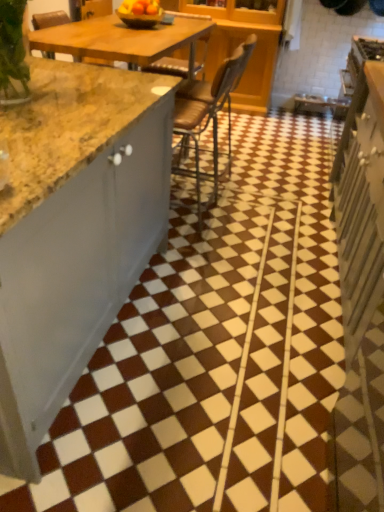
Question: Can brown glossy tile at center be found inside white glossy cabinet at right?

Choices:
 (A) yes
 (B) no

Answer: (B)

Question: From a real-world perspective, is white glossy cabinet at right physically above brown glossy tile at center?

Choices:
 (A) yes
 (B) no

Answer: (A)

Question: From the image's perspective, does white glossy cabinet at right appear lower than brown glossy tile at center?

Choices:
 (A) no
 (B) yes

Answer: (B)

Question: Considering the relative positions of white glossy cabinet at right and brown glossy tile at center in the image provided, is white glossy cabinet at right to the right of brown glossy tile at center from the viewer's perspective?

Choices:
 (A) yes
 (B) no

Answer: (A)

Question: Can you confirm if white glossy cabinet at right is bigger than brown glossy tile at center?

Choices:
 (A) yes
 (B) no

Answer: (B)

Question: Considering the relative positions of brown leather chair at center and white glossy cabinet at right in the image provided, is brown leather chair at center to the left or to the right of white glossy cabinet at right?

Choices:
 (A) right
 (B) left

Answer: (B)

Question: Relative to white glossy cabinet at right, is brown leather chair at center in front or behind?

Choices:
 (A) behind
 (B) front

Answer: (A)

Question: Considering the positions of brown leather chair at center and white glossy cabinet at right in the image, is brown leather chair at center wider or thinner than white glossy cabinet at right?

Choices:
 (A) thin
 (B) wide

Answer: (B)

Question: Does point (243, 46) appear closer or farther from the camera than point (344, 180)?

Choices:
 (A) farther
 (B) closer

Answer: (A)

Question: From a real-world perspective, is white glossy cabinet at right above or below brown leather chair at center?

Choices:
 (A) above
 (B) below

Answer: (B)

Question: In the image, is white glossy cabinet at right positioned in front of or behind brown leather chair at center?

Choices:
 (A) behind
 (B) front

Answer: (B)

Question: Based on their sizes in the image, would you say white glossy cabinet at right is bigger or smaller than brown leather chair at center?

Choices:
 (A) big
 (B) small

Answer: (A)

Question: Considering the positions of white glossy cabinet at right and brown leather chair at center in the image, is white glossy cabinet at right taller or shorter than brown leather chair at center?

Choices:
 (A) short
 (B) tall

Answer: (A)

Question: Looking at their shapes, would you say white glossy cabinet at right is wider or thinner than matte yellow bowl at upper center?

Choices:
 (A) thin
 (B) wide

Answer: (B)

Question: Based on their positions, is white glossy cabinet at right located to the left or right of matte yellow bowl at upper center?

Choices:
 (A) left
 (B) right

Answer: (B)